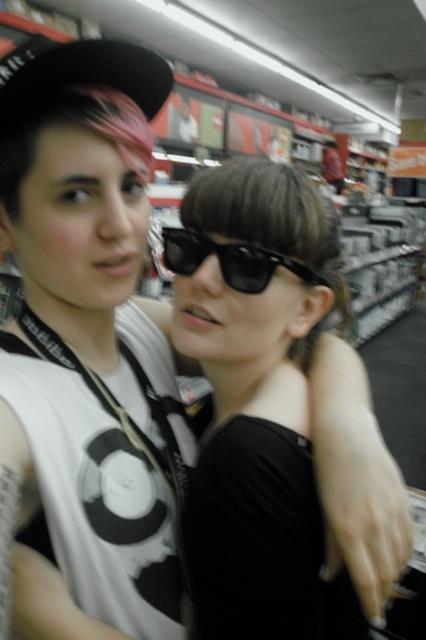
Can you confirm if black matte sunglasses at center is shorter than black matte dress at center?

In fact, black matte sunglasses at center may be taller than black matte dress at center.

Can you confirm if black matte sunglasses at center is positioned to the left of black matte dress at center?

No, black matte sunglasses at center is not to the left of black matte dress at center.

Image resolution: width=426 pixels, height=640 pixels. I want to click on black matte sunglasses at center, so click(271, 396).

Between black matte dress at center and black plastic sunglasses at center, which one has more height?

black matte dress at center is taller.

Is black matte dress at center thinner than black plastic sunglasses at center?

In fact, black matte dress at center might be wider than black plastic sunglasses at center.

Is point (255, 472) in front of point (161, 228)?

Yes, it is.

Locate an element on the screen. black matte dress at center is located at coordinates (261, 540).

Does black matte sunglasses at center appear on the left side of black plastic sunglasses at center?

Incorrect, black matte sunglasses at center is not on the left side of black plastic sunglasses at center.

Between black matte sunglasses at center and black plastic sunglasses at center, which one is positioned higher?

black plastic sunglasses at center is above.

Describe the element at coordinates (271, 396) in the screenshot. Image resolution: width=426 pixels, height=640 pixels. I see `black matte sunglasses at center` at that location.

I want to click on black matte sunglasses at center, so click(x=271, y=396).